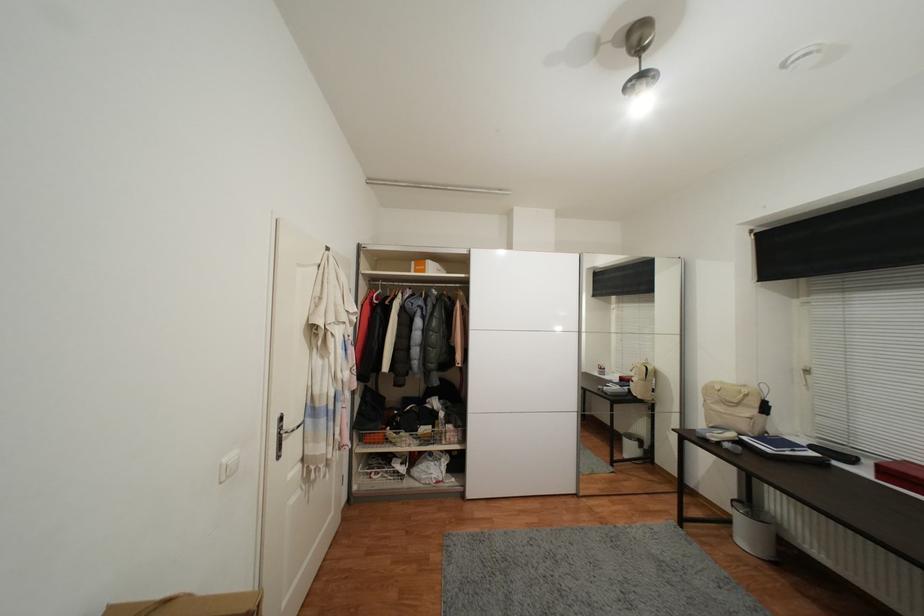
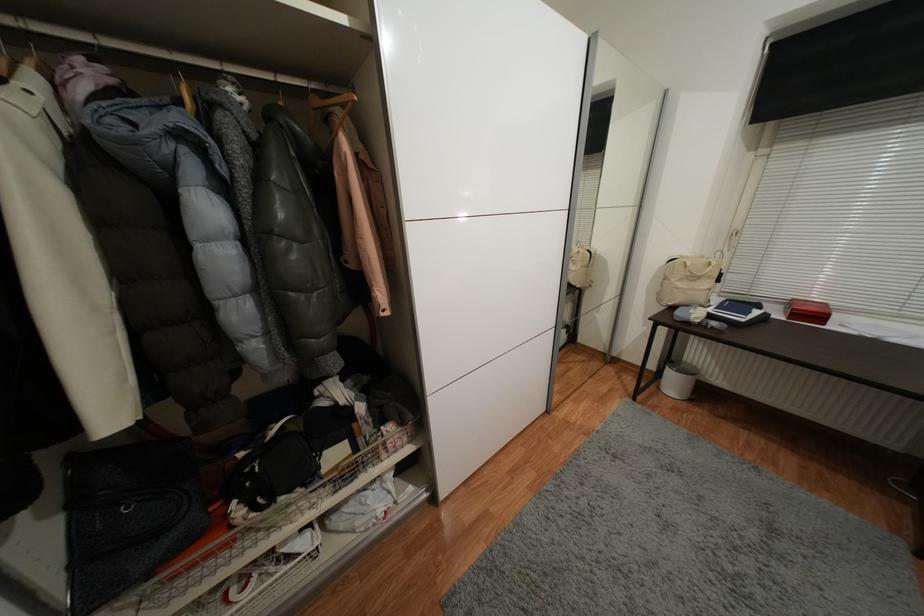
Where in the second image is the point corresponding to the point at 748,387 from the first image?

(707, 257)